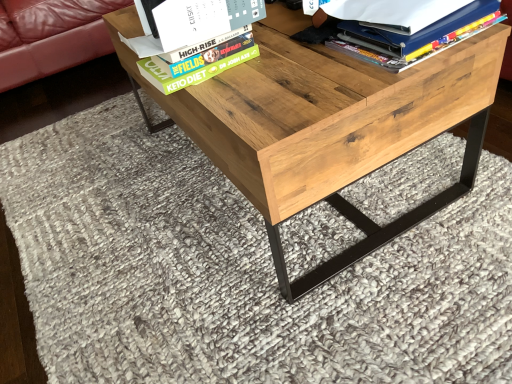
The width and height of the screenshot is (512, 384). What do you see at coordinates (326, 125) in the screenshot?
I see `natural wood table at center` at bounding box center [326, 125].

From the picture: In order to face hardcover book at upper center, should I rotate leftwards or rightwards?

Turn left approximately 8.253 degrees to face it.

Find the location of a particular element. The image size is (512, 384). matte blue folder at upper right is located at coordinates (414, 37).

In the image, is natural wood table at center on the left side or the right side of hardcover book at upper center?

From the image, it's evident that natural wood table at center is to the right of hardcover book at upper center.

Can you confirm if natural wood table at center is wider than hardcover book at upper center?

Correct, the width of natural wood table at center exceeds that of hardcover book at upper center.

Between natural wood table at center and hardcover book at upper center, which one is positioned behind?

hardcover book at upper center is more distant.

Identify the location of table lying on the right of hardcover book at upper center. (326, 125).

Who is more distant, matte blue folder at upper right or hardcover book at upper center?

hardcover book at upper center is further from the camera.

Between matte blue folder at upper right and hardcover book at upper center, which one appears on the right side from the viewer's perspective?

matte blue folder at upper right.

Does matte blue folder at upper right have a smaller size compared to hardcover book at upper center?

No, matte blue folder at upper right is not smaller than hardcover book at upper center.

Is hardcover book at upper center aimed at matte blue folder at upper right?

No, hardcover book at upper center is not facing towards matte blue folder at upper right.

In terms of height, does hardcover book at upper center look taller or shorter compared to matte blue folder at upper right?

hardcover book at upper center is shorter than matte blue folder at upper right.

Consider the image. Would you say hardcover book at upper center is outside matte blue folder at upper right?

Yes.

What are the coordinates of `book lying on the right of hardcover book at upper center` in the screenshot? It's located at (414, 37).

Which object is further away from the camera taking this photo, hardcover book at upper center or natural wood table at center?

hardcover book at upper center.

In the image, is hardcover book at upper center on the left side or the right side of natural wood table at center?

Clearly, hardcover book at upper center is on the left of natural wood table at center in the image.

Based on the photo, does hardcover book at upper center have a larger size compared to natural wood table at center?

No.

From a real-world perspective, between matte blue folder at upper right and natural wood table at center, who is vertically lower?

natural wood table at center.

Considering the sizes of objects matte blue folder at upper right and natural wood table at center in the image provided, who is taller, matte blue folder at upper right or natural wood table at center?

natural wood table at center.

Is matte blue folder at upper right bigger or smaller than natural wood table at center?

Considering their sizes, matte blue folder at upper right takes up less space than natural wood table at center.

Is matte blue folder at upper right facing away from natural wood table at center?

No, natural wood table at center is not at the back of matte blue folder at upper right.

Can you confirm if natural wood table at center is bigger than matte blue folder at upper right?

Answer: Yes, natural wood table at center is bigger than matte blue folder at upper right.

Which of these two, natural wood table at center or matte blue folder at upper right, stands taller?

With more height is natural wood table at center.

How different are the orientations of natural wood table at center and matte blue folder at upper right in degrees?

The angle between the facing direction of natural wood table at center and the facing direction of matte blue folder at upper right is 178 degrees.

Which object is closer to the camera taking this photo, natural wood table at center or matte blue folder at upper right?

natural wood table at center.

At what (x,y) coordinates should I click in order to perform the action: click on paperback book above the natural wood table at center (from a real-world perspective). Please return your answer as a coordinate pair (x, y). Image resolution: width=512 pixels, height=384 pixels. Looking at the image, I should click on (198, 64).

This screenshot has height=384, width=512. What are the coordinates of `paperback book on the left of matte blue folder at upper right` in the screenshot? It's located at (198, 64).

Considering their positions, is matte blue folder at upper right positioned closer to hardcover book at upper center than natural wood table at center?

natural wood table at center is closer to hardcover book at upper center.

Which object lies further to the anchor point matte blue folder at upper right, hardcover book at upper center or natural wood table at center?

Among the two, hardcover book at upper center is located further to matte blue folder at upper right.

Considering their positions, is natural wood table at center positioned further to matte blue folder at upper right than hardcover book at upper center?

hardcover book at upper center is positioned further to the anchor matte blue folder at upper right.

When comparing their distances from hardcover book at upper center, does natural wood table at center or matte blue folder at upper right seem closer?

The object closer to hardcover book at upper center is natural wood table at center.

From the image, which object appears to be farther from natural wood table at center, matte blue folder at upper right or hardcover book at upper center?

Among the two, hardcover book at upper center is located further to natural wood table at center.

In the scene shown: Which object lies further to the anchor point natural wood table at center, hardcover book at upper center or matte blue folder at upper right?

hardcover book at upper center lies further to natural wood table at center than the other object.

Find the location of a particular element. The image size is (512, 384). table located between hardcover book at upper center and matte blue folder at upper right in the left-right direction is located at coordinates (326, 125).